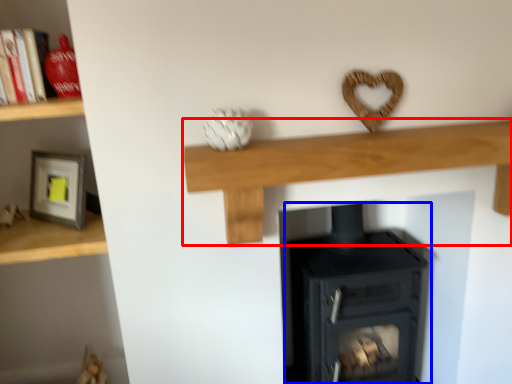
Question: Which object appears farthest to the camera in this image, shelf (highlighted by a red box) or wood burning stove (highlighted by a blue box)?

Choices:
 (A) shelf
 (B) wood burning stove

Answer: (B)